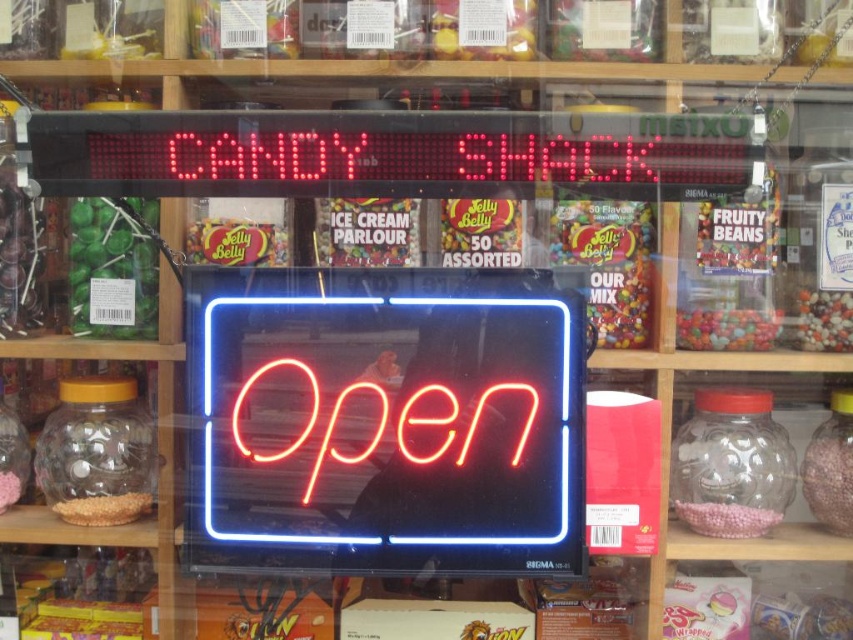
Is neon sign at center positioned behind shiny yellow jelly bean at center left?

No.

Identify the location of neon sign at center. (393, 420).

The image size is (853, 640). What are the coordinates of `neon sign at center` in the screenshot? It's located at (393, 420).

Can you confirm if multicolored candy at center is smaller than shiny yellow jelly bean at center left?

No.

Is point (392, 248) positioned after point (283, 250)?

No, it is in front of (283, 250).

Is point (325, 214) positioned before point (218, 243)?

No, (325, 214) is further to viewer.

The width and height of the screenshot is (853, 640). Find the location of `multicolored candy at center`. multicolored candy at center is located at coordinates click(x=366, y=230).

Can you confirm if neon sign at center is positioned above pink matte candy jar at right?

Indeed, neon sign at center is positioned over pink matte candy jar at right.

From the picture: Measure the distance between neon sign at center and pink matte candy jar at right.

They are 27.27 inches apart.

Is point (502, 508) positioned after point (828, 468)?

No, it is not.

In order to click on neon sign at center in this screenshot , I will do `click(393, 420)`.